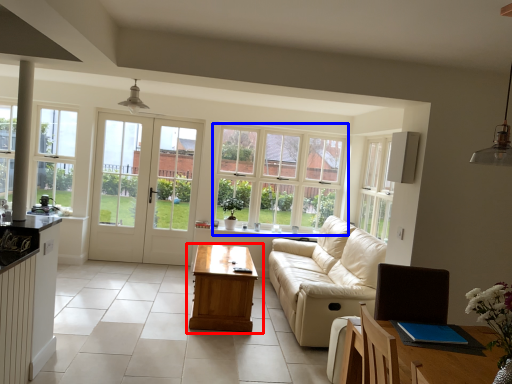
Question: Which of the following is the closest to the observer, table (highlighted by a red box) or window (highlighted by a blue box)?

Choices:
 (A) table
 (B) window

Answer: (A)